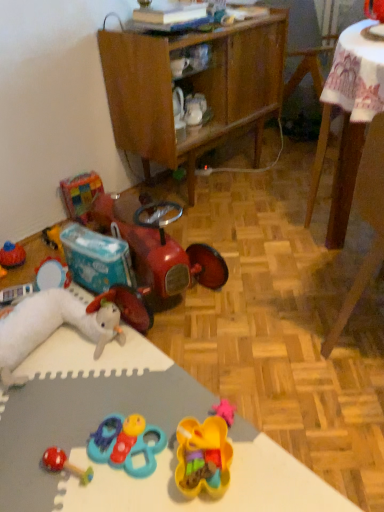
Image resolution: width=384 pixels, height=512 pixels. What are the coordinates of `spots to the right of translucent plastic container at center, marked as the second toy in a right-to-left arrangement` in the screenshot? It's located at (265, 461).